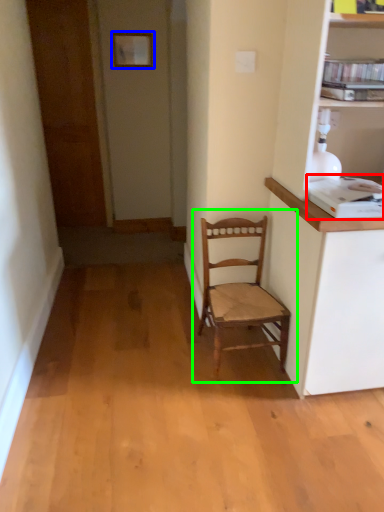
Question: Based on their relative distances, which object is farther from appliance (highlighted by a red box)? Choose from picture frame (highlighted by a blue box) and chair (highlighted by a green box).

Choices:
 (A) picture frame
 (B) chair

Answer: (A)